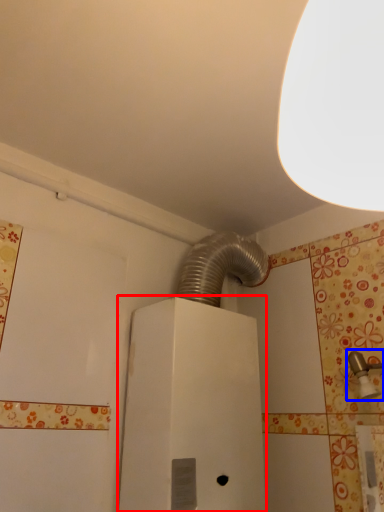
Question: Which object appears closest to the camera in this image, water heater (highlighted by a red box) or plumbing fixture (highlighted by a blue box)?

Choices:
 (A) water heater
 (B) plumbing fixture

Answer: (B)